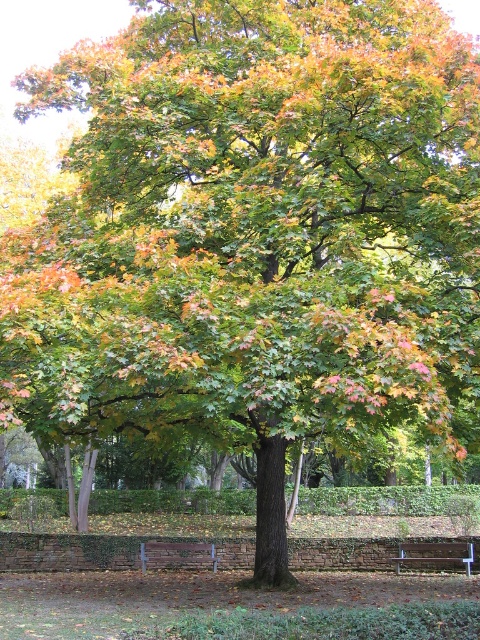
Who is shorter, wooden bench at lower right or brown wooden bench at lower center?

brown wooden bench at lower center

Where is `wooden bench at lower right`? wooden bench at lower right is located at coordinates (435, 554).

Who is higher up, green leafy tree at center or brown wooden bench at lower center?

green leafy tree at center

What do you see at coordinates (232, 579) in the screenshot?
I see `green leafy tree at center` at bounding box center [232, 579].

Where is `green leafy tree at center`? The image size is (480, 640). green leafy tree at center is located at coordinates (232, 579).

Is green leafy tree at center shorter than wooden bench at lower right?

In fact, green leafy tree at center may be taller than wooden bench at lower right.

Identify the location of green leafy tree at center. The height and width of the screenshot is (640, 480). (232, 579).

You are a GUI agent. You are given a task and a screenshot of the screen. Output one action in this format:
    pyautogui.click(x=<x>, y=<y>)
    Task: Click on the green leafy tree at center
    This screenshot has height=640, width=480.
    Given the screenshot: What is the action you would take?
    pyautogui.click(x=232, y=579)